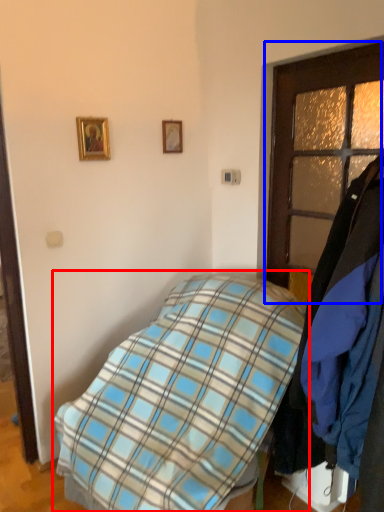
Question: Which of the following is the farthest to the observer, bed (highlighted by a red box) or door (highlighted by a blue box)?

Choices:
 (A) bed
 (B) door

Answer: (B)